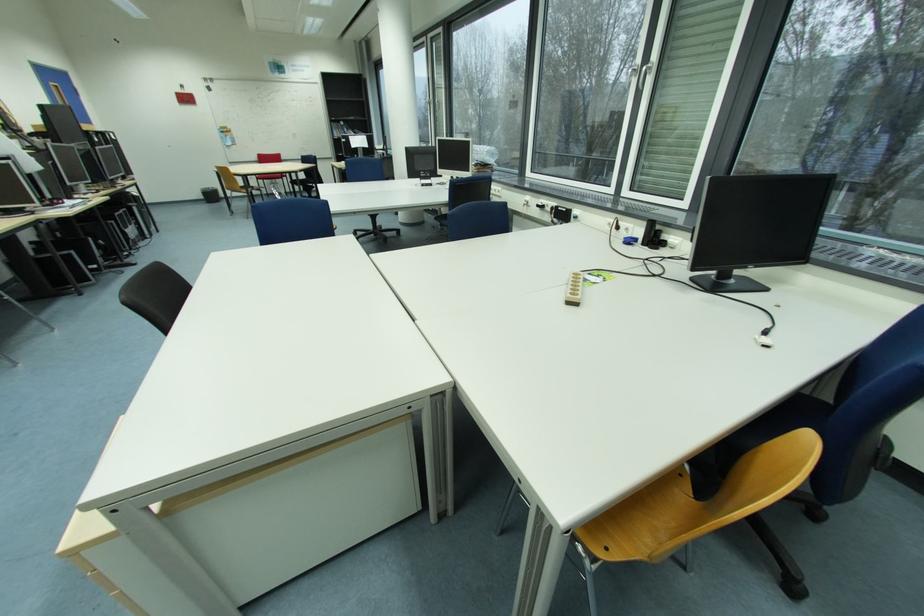
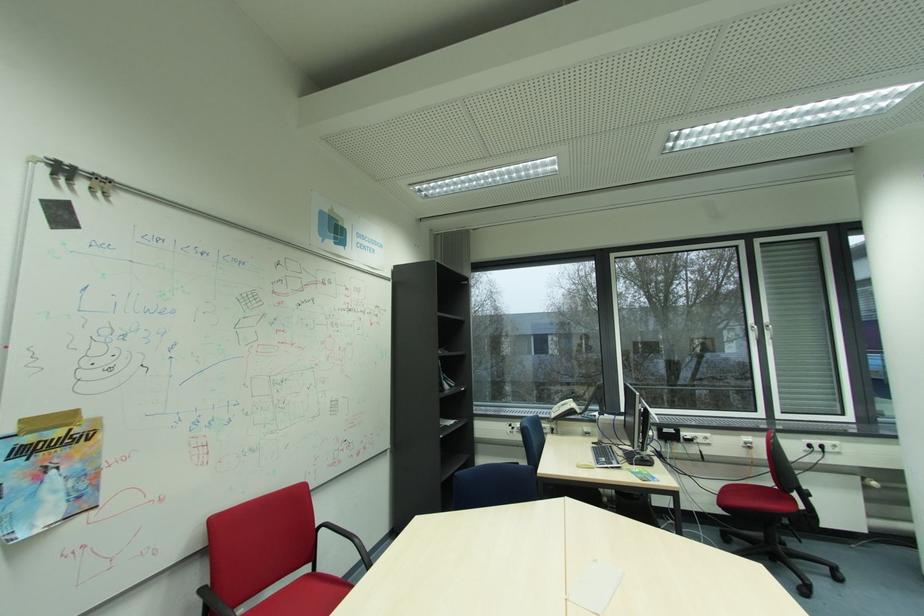
Locate, in the second image, the point that corresponds to point 229,132 in the first image.

(31, 452)